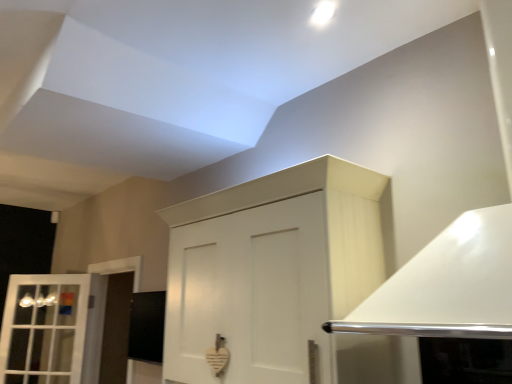
You are a GUI agent. You are given a task and a screenshot of the screen. Output one action in this format:
    pyautogui.click(x=<x>, y=<y>)
    Task: Click on the white matte cabinet at center
    This screenshot has width=512, height=384.
    Given the screenshot: What is the action you would take?
    pyautogui.click(x=271, y=271)

What do you see at coordinates (271, 271) in the screenshot?
I see `white matte cabinet at center` at bounding box center [271, 271].

Measure the distance between white matte cabinet at center and camera.

4.40 feet.

Locate an element on the screen. The width and height of the screenshot is (512, 384). white glass window at left is located at coordinates [x=44, y=329].

What do you see at coordinates (44, 329) in the screenshot?
I see `white glass window at left` at bounding box center [44, 329].

Locate an element on the screen. This screenshot has height=384, width=512. white matte cabinet at center is located at coordinates (271, 271).

Considering the positions of objects white glass window at left and white matte cabinet at center in the image provided, who is more to the right, white glass window at left or white matte cabinet at center?

Positioned to the right is white matte cabinet at center.

Does white glass window at left come behind white matte cabinet at center?

Yes, white glass window at left is further from the viewer.

Does point (14, 304) appear closer or farther from the camera than point (172, 342)?

Point (14, 304) appears to be farther away from the viewer than point (172, 342).

Based on the photo, from the image's perspective, who appears lower, white glass window at left or white matte cabinet at center?

white glass window at left appears lower in the image.

From a real-world perspective, is white glass window at left positioned above or below white matte cabinet at center?

Clearly, from a real-world perspective, white glass window at left is below white matte cabinet at center.

Which of these two, white glass window at left or white matte cabinet at center, is thinner?

white glass window at left is thinner.

Who is shorter, white glass window at left or white matte cabinet at center?

white matte cabinet at center.

Looking at the image, does white glass window at left seem bigger or smaller compared to white matte cabinet at center?

white glass window at left is smaller than white matte cabinet at center.

Do you think white glass window at left is within white matte cabinet at center, or outside of it?

white glass window at left is not inside white matte cabinet at center, it's outside.

Can you see white glass window at left touching white matte cabinet at center?

No, white glass window at left is not making contact with white matte cabinet at center.

Is white glass window at left oriented towards white matte cabinet at center?

No, white glass window at left is not aimed at white matte cabinet at center.

The height and width of the screenshot is (384, 512). I want to click on window that appears on the left of white matte cabinet at center, so click(x=44, y=329).

Between white matte cabinet at center and white glass window at left, which one appears on the left side from the viewer's perspective?

white glass window at left is more to the left.

Between white matte cabinet at center and white glass window at left, which one is positioned behind?

white glass window at left is further from the camera.

Considering the positions of point (180, 250) and point (31, 358), is point (180, 250) closer or farther from the camera than point (31, 358)?

Point (180, 250) appears to be closer to the viewer than point (31, 358).

From the image's perspective, is white matte cabinet at center located above or below white glass window at left?

white matte cabinet at center is above white glass window at left.

From a real-world perspective, is white matte cabinet at center located higher than white glass window at left?

Yes, from a real-world perspective, white matte cabinet at center is on top of white glass window at left.

Is white matte cabinet at center wider than white glass window at left?

Yes, white matte cabinet at center is wider than white glass window at left.

Considering the sizes of objects white matte cabinet at center and white glass window at left in the image provided, who is shorter, white matte cabinet at center or white glass window at left?

white matte cabinet at center.

In terms of size, does white matte cabinet at center appear bigger or smaller than white glass window at left?

In the image, white matte cabinet at center appears to be larger than white glass window at left.

Is white matte cabinet at center outside of white glass window at left?

Yes, white matte cabinet at center is not within white glass window at left.

Is white matte cabinet at center placed right next to white glass window at left?

They are not placed beside each other.

Could you tell me if white matte cabinet at center is turned towards white glass window at left?

No, white matte cabinet at center is not turned towards white glass window at left.

Find the location of a particular element. window that is below the white matte cabinet at center (from the image's perspective) is located at coordinates (44, 329).

In the image, there is a white glass window at left. Identify the location of cabinetry above it (from the image's perspective). (271, 271).

Locate an element on the screen. window on the left of white matte cabinet at center is located at coordinates (44, 329).